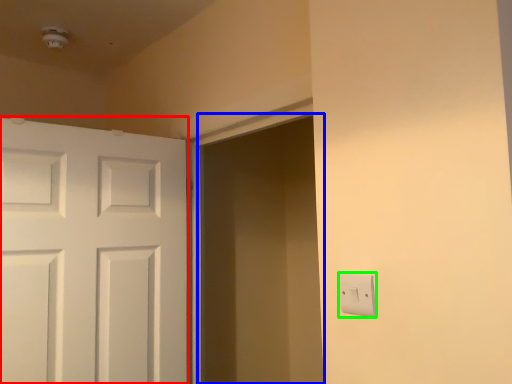
Question: Based on their relative distances, which object is farther from door (highlighted by a red box)? Choose from screen door (highlighted by a blue box) and light switch (highlighted by a green box).

Choices:
 (A) screen door
 (B) light switch

Answer: (B)